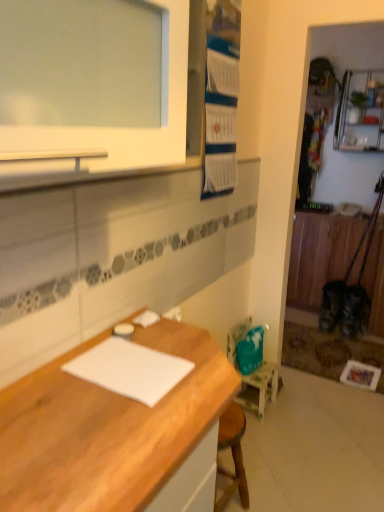
At what (x,y) coordinates should I click in order to perform the action: click on free space in front of white paper at center. Please return your answer as a coordinate pair (x, y). Looking at the image, I should click on (108, 421).